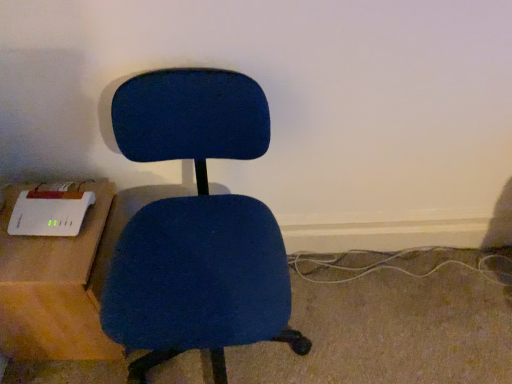
Question: Considering the positions of point (3, 215) and point (126, 153), is point (3, 215) closer or farther from the camera than point (126, 153)?

Choices:
 (A) farther
 (B) closer

Answer: (A)

Question: Do you think white plastic router at left is within matte blue office chair at center, or outside of it?

Choices:
 (A) inside
 (B) outside

Answer: (B)

Question: From the image's perspective, relative to matte blue office chair at center, is white plastic router at left above or below?

Choices:
 (A) below
 (B) above

Answer: (A)

Question: In terms of size, does matte blue office chair at center appear bigger or smaller than white plastic router at left?

Choices:
 (A) small
 (B) big

Answer: (B)

Question: From their relative heights in the image, would you say matte blue office chair at center is taller or shorter than white plastic router at left?

Choices:
 (A) tall
 (B) short

Answer: (A)

Question: Is matte blue office chair at center inside or outside of white plastic router at left?

Choices:
 (A) outside
 (B) inside

Answer: (A)

Question: In terms of width, does matte blue office chair at center look wider or thinner when compared to white plastic router at left?

Choices:
 (A) wide
 (B) thin

Answer: (A)